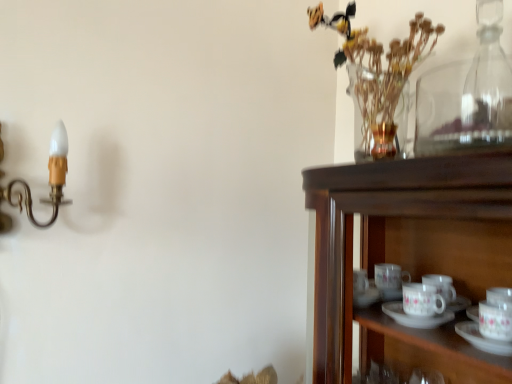
Question: Is point (393, 145) closer or farther from the camera than point (50, 170)?

Choices:
 (A) closer
 (B) farther

Answer: (A)

Question: In terms of height, does clear glass vase at upper right look taller or shorter compared to gold brass candle holder at left?

Choices:
 (A) tall
 (B) short

Answer: (A)

Question: Which of these objects is positioned farthest from the clear glass vase at upper right?

Choices:
 (A) gold brass candle holder at left
 (B) transparent glass bottle at upper right

Answer: (A)

Question: Which object is the farthest from the gold brass candle holder at left?

Choices:
 (A) clear glass vase at upper right
 (B) transparent glass bottle at upper right

Answer: (B)